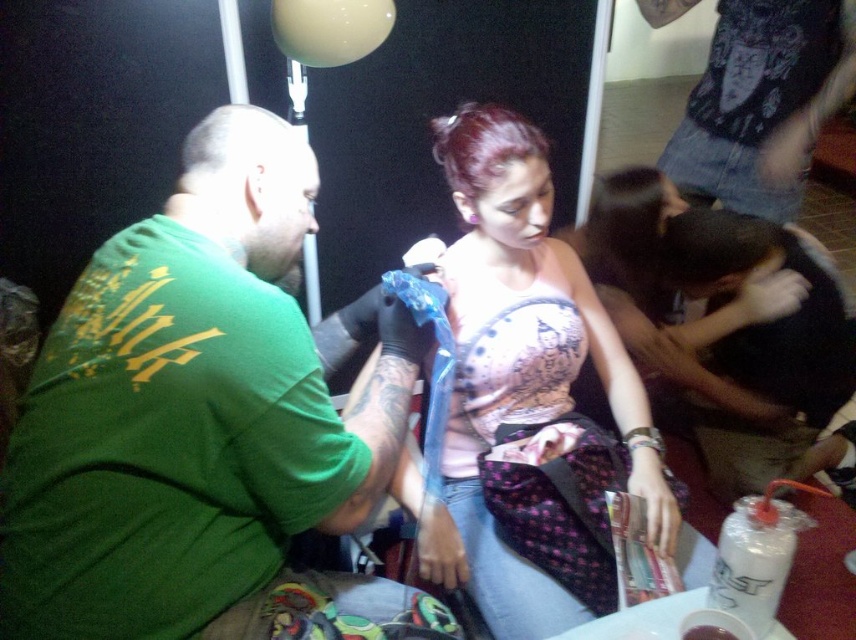
Looking at the tattoo parlor scene, there is a matte pink tank top at center and a denim jeans at upper right. Which one is positioned to the left of the other?

The matte pink tank top at center is to the left of denim jeans at upper right.

You are a customer in the tattoo parlor and need to place a small item on the table between the green matte shirt at left and the denim jeans at upper right. Can you do this without moving either of them?

The green matte shirt at left is located below the denim jeans at upper right, so there is space between them on the table to place the item without moving either.

You are a customer in a tattoo parlor and want to place a cup of water on the table in front of you. The cup has a diameter of 3.5 inches. If the green matte shirt at left is currently on the table, can you place the cup next to it without overlapping?

The objects are 31.56 inches apart, so yes, there is enough space to place the cup next to the green matte shirt at left without overlapping.